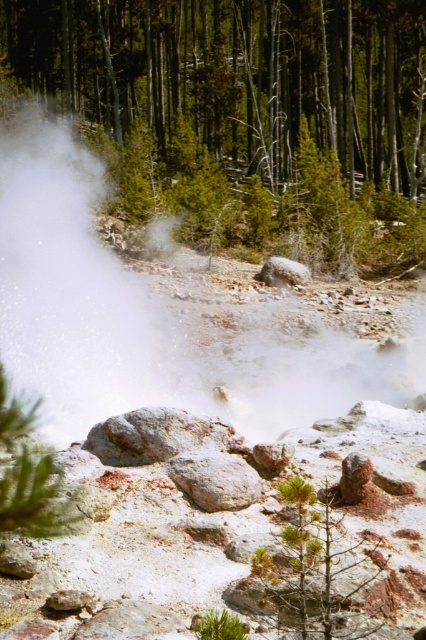
Question: In this image, where is green matte tree at upper center located relative to white vapor at center?

Choices:
 (A) below
 (B) above

Answer: (B)

Question: Which of the following is the farthest from the observer?

Choices:
 (A) white vapor at center
 (B) green matte tree at upper center

Answer: (B)

Question: Is the position of green matte tree at upper center less distant than that of white vapor at center?

Choices:
 (A) no
 (B) yes

Answer: (A)

Question: Is green matte tree at upper center bigger than white vapor at center?

Choices:
 (A) no
 (B) yes

Answer: (B)